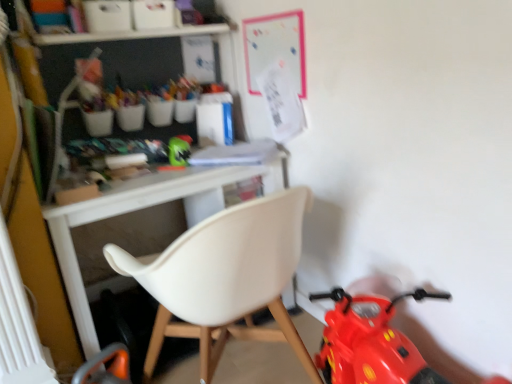
This screenshot has height=384, width=512. What are the coordinates of `free location in front of green matte helmet at center` in the screenshot? It's located at (168, 175).